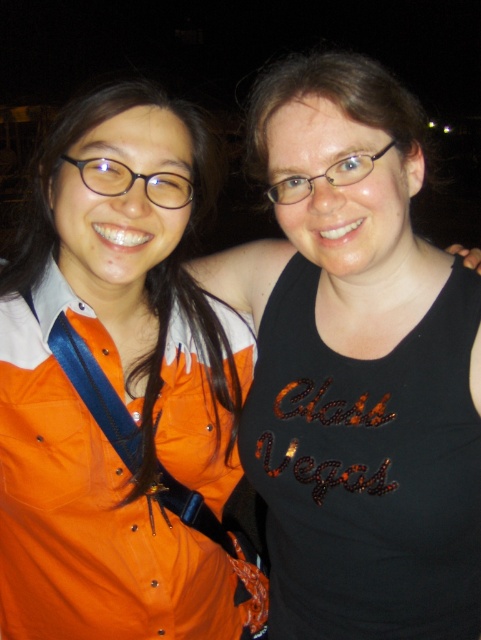
You are a photographer holding a camera that requires a minimum distance of 1.2 meters to focus properly. You just took a photo of two people. One is wearing a black sequined tank top at center. Can you confirm if the black sequened tank top at center was in focus?

The distance between the black sequined tank top at center and the camera is 1.02 meters, which is less than the required 1.2 meters. Therefore, the black sequened tank top at center would likely be out of focus.

You are a photographer trying to adjust the lighting for a photo shoot. You notice two items in the scene that might reflect light differently. Which item, the black sequined tank top at center or the orange fabric apron at left, is shorter in height?

The black sequined tank top at center is not as tall as the orange fabric apron at left, so the black sequined tank top at center is shorter in height.